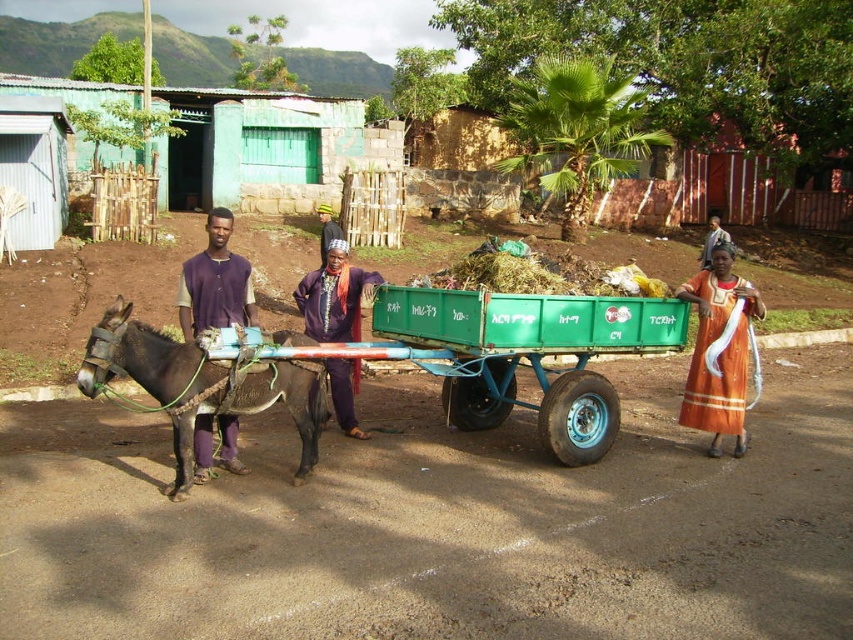
Question: Among these objects, which one is farthest from the camera?

Choices:
 (A) purple fabric shirt at left
 (B) dark brown leather mule at left
 (C) orange fabric dress at right
 (D) purple fabric at center

Answer: (C)

Question: Which of the following is the farthest from the observer?

Choices:
 (A) (196, 381)
 (B) (704, 337)
 (C) (714, 227)
 (D) (198, 324)

Answer: (C)

Question: Does dark brown leather mule at left appear over purple fabric at center?

Choices:
 (A) no
 (B) yes

Answer: (A)

Question: Does purple fabric shirt at left have a smaller size compared to purple fabric at center?

Choices:
 (A) yes
 (B) no

Answer: (A)

Question: Which point is farther to the camera?

Choices:
 (A) (215, 317)
 (B) (740, 356)
 (C) (172, 365)
 (D) (699, 268)

Answer: (D)

Question: Observing the image, what is the correct spatial positioning of orange fabric dress at center in reference to purple fabric at center?

Choices:
 (A) above
 (B) below

Answer: (B)